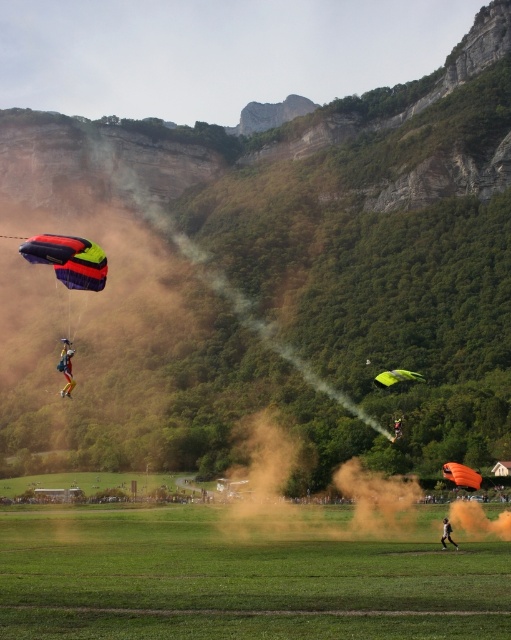
You are a pilot observing the parachutists from above. You notice the yellow fabric parachute at left and the orange fabric parachute at lower right. Which parachute is higher in the sky?

The yellow fabric parachute at left is positioned over the orange fabric parachute at lower right, so it is higher in the sky.

You are a photographer planning to capture the parachutists landing on the green grass field at lower center. Based on the coordinates provided, where should you position yourself to ensure the parachutists are centered in your shot?

The green grass field at lower center is located at coordinates point [238,580]. To center the parachutists landing there, position yourself directly above or slightly behind this coordinate point to frame the shot properly.